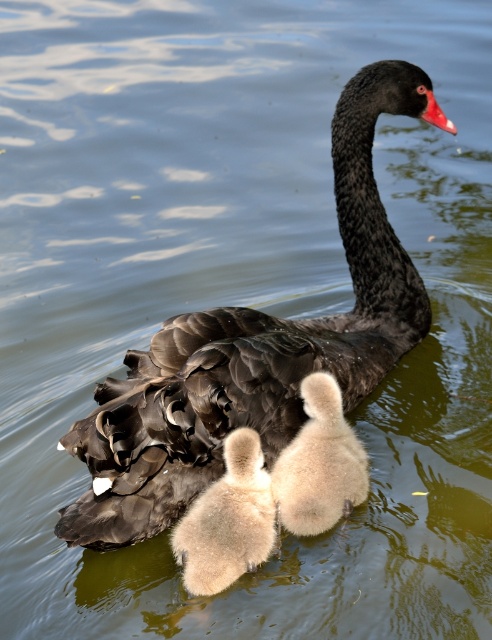
You are a wildlife photographer trying to capture a closeup of the black glossy swan at center and the fluffy white duckling at center in the image. Your camera can only focus on objects within a 15 inch range. Do you think you can capture both in focus at the same time?

The black glossy swan at center and the fluffy white duckling at center are 15.18 inches apart. Since the distance between them exceeds the camera focus range of 15 inches, you cannot capture both in focus simultaneously.

What are the coordinates of the black glossy swan at center?

The black glossy swan at center is located at point (x=253, y=349).

You are a photographer trying to capture the black glossy swan at center and the fluffy white duckling at center in a single shot. Based on their positions, will the swan block the view of the duckling in your photo?

The black glossy swan at center is above the fluffy white duckling at center, so the swan will block the view of the duckling in the photo.